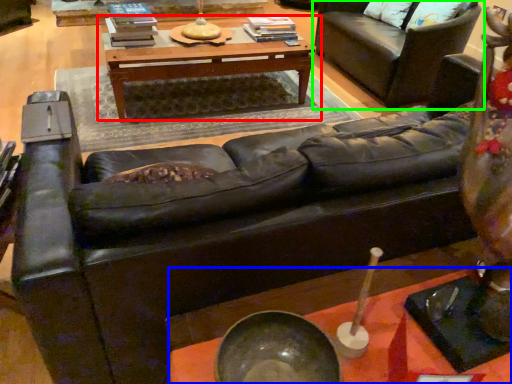
Question: Which object is the closest to the table (highlighted by a red box)? Choose among these: table (highlighted by a blue box) or studio couch (highlighted by a green box).

Choices:
 (A) table
 (B) studio couch

Answer: (B)